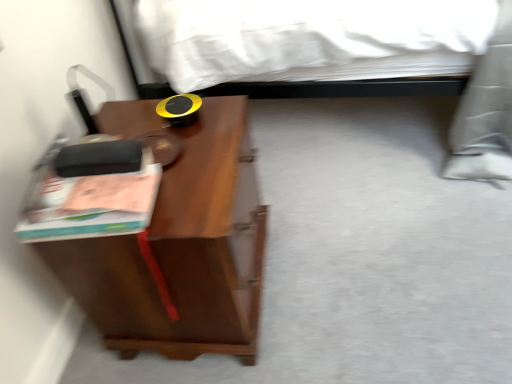
Identify the location of free space to the right of matte pink paperback book at left. (196, 178).